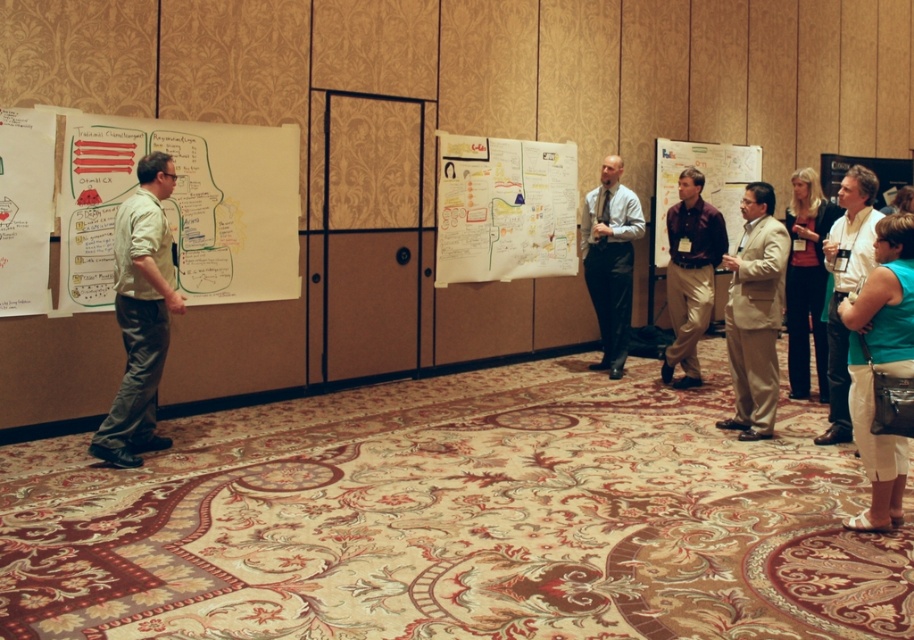
You are a photographer in the room and want to take a photo that includes both the light beige shirt at left and the teal fabric shirt at center. Which shirt should you adjust your camera focus to ensure both are in frame without moving your position?

Since the light beige shirt at left is smaller than the teal fabric shirt at center, you should focus on the teal fabric shirt at center to ensure both shirts are within the camera frame without moving your position.